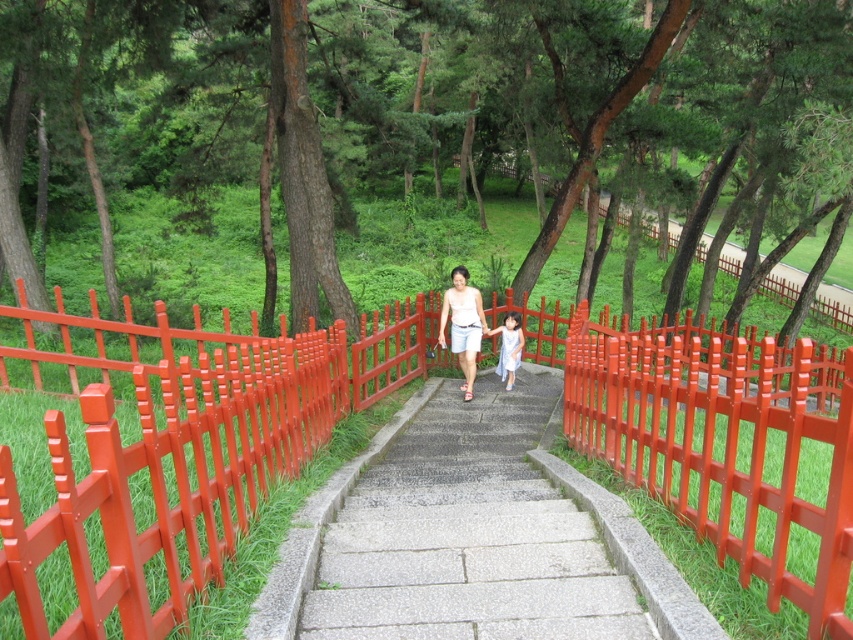
Is point (647, 484) positioned behind point (515, 310)?

That is False.

Between point (813, 589) and point (511, 320), which one is positioned behind?

The point (511, 320) is behind.

The image size is (853, 640). I want to click on red plastic fence at center, so click(x=729, y=448).

Who is taller, gray concrete stairs at center or light purple fabric dress at center?

light purple fabric dress at center

Who is more forward, (611, 572) or (508, 346)?

Point (611, 572)

This screenshot has width=853, height=640. In order to click on gray concrete stairs at center in this screenshot , I will do `click(468, 534)`.

Which is more to the left, red plastic fence at center or matte white blouse at center?

matte white blouse at center

Is red plastic fence at center bigger than matte white blouse at center?

Indeed, red plastic fence at center has a larger size compared to matte white blouse at center.

You are a GUI agent. You are given a task and a screenshot of the screen. Output one action in this format:
    pyautogui.click(x=<x>, y=<y>)
    Task: Click on the red plastic fence at center
    The image size is (853, 640).
    Given the screenshot: What is the action you would take?
    pyautogui.click(x=729, y=448)

Find the location of a particular element. The image size is (853, 640). red plastic fence at center is located at coordinates (729, 448).